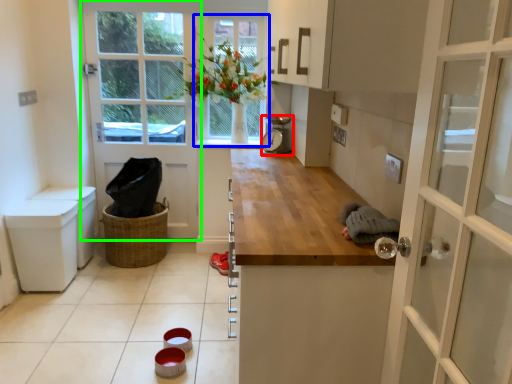
Question: Based on their relative distances, which object is farther from appliance (highlighted by a red box)? Choose from window (highlighted by a blue box) and door (highlighted by a green box).

Choices:
 (A) window
 (B) door

Answer: (B)